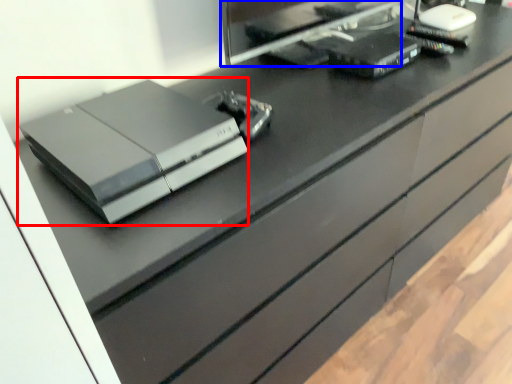
Question: Among these objects, which one is farthest to the camera, printer (highlighted by a red box) or desktop computer (highlighted by a blue box)?

Choices:
 (A) printer
 (B) desktop computer

Answer: (B)